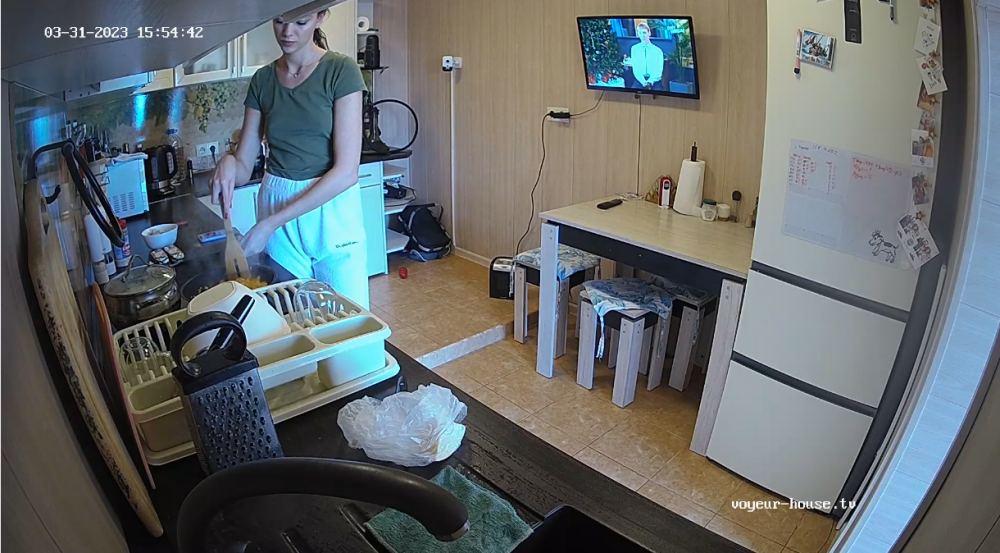
Identify the location of worn plastic cutting board. (56, 286).